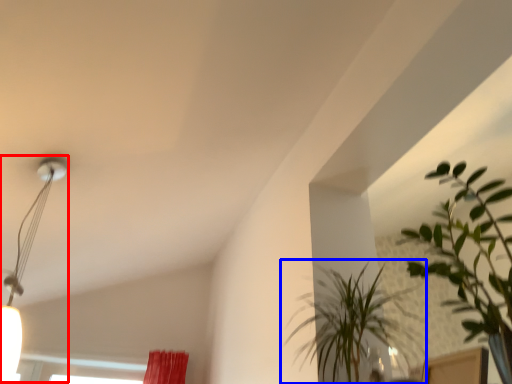
Question: Which object is closer to the camera taking this photo, lamp (highlighted by a red box) or houseplant (highlighted by a blue box)?

Choices:
 (A) lamp
 (B) houseplant

Answer: (B)